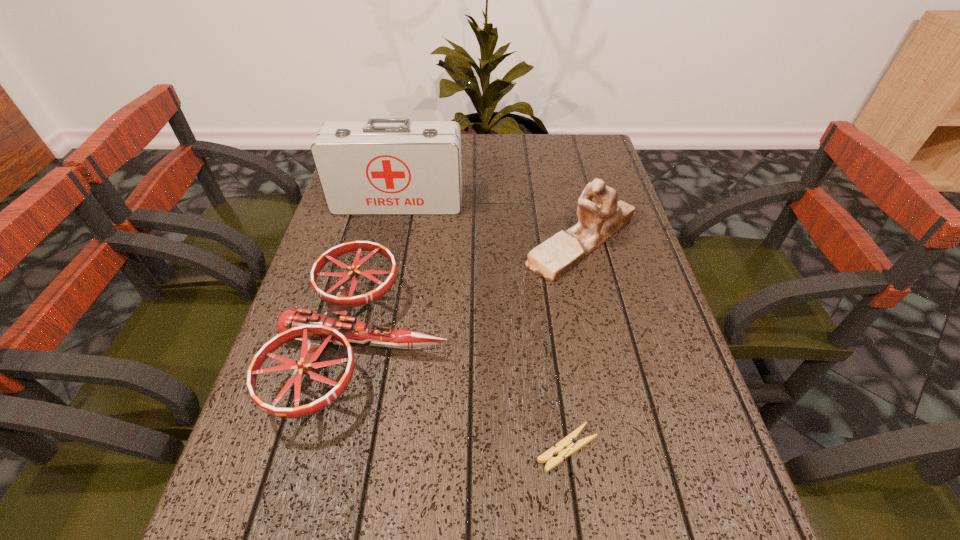
Where is `free region that satisfies the following two spatial constraints: 1. on the front-facing side of the shortest object; 2. on the left side of the first-aid kit`? The width and height of the screenshot is (960, 540). free region that satisfies the following two spatial constraints: 1. on the front-facing side of the shortest object; 2. on the left side of the first-aid kit is located at coordinates (346, 449).